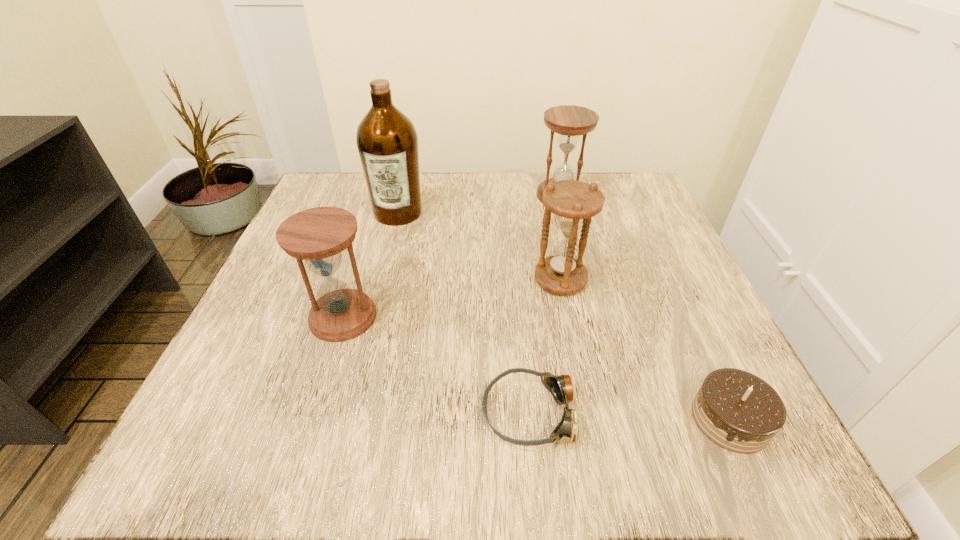
Identify which object is located as the fifth nearest to the chocolate cake. Please provide its 2D coordinates. Your answer should be formatted as a tuple, i.e. [(x, y)], where the tuple contains the x and y coordinates of a point satisfying the conditions above.

[(387, 141)]

At what (x,y) coordinates should I click in order to perform the action: click on object that is the fourth closest to the chocolate cake. Please return your answer as a coordinate pair (x, y). Looking at the image, I should click on (318, 236).

Point out which hourglass is positioned as the second nearest to the farthest hourglass. Please provide its 2D coordinates. Your answer should be formatted as a tuple, i.e. [(x, y)], where the tuple contains the x and y coordinates of a point satisfying the conditions above.

[(318, 236)]

You are a GUI agent. You are given a task and a screenshot of the screen. Output one action in this format:
    pyautogui.click(x=<x>, y=<y>)
    Task: Click on the hourglass that is the second closest to the chocolate cake
    This screenshot has width=960, height=540.
    Given the screenshot: What is the action you would take?
    pyautogui.click(x=569, y=121)

Locate an element on the screen. vacant region that satisfies the following two spatial constraints: 1. on the label of the rightmost object; 2. on the right side of the tallest object is located at coordinates (347, 419).

Locate an element on the screen. vacant area in the image that satisfies the following two spatial constraints: 1. through the lenses of the second shortest object; 2. on the right side of the shortest object is located at coordinates (532, 419).

Image resolution: width=960 pixels, height=540 pixels. I want to click on vacant space that satisfies the following two spatial constraints: 1. through the lenses of the goggles; 2. on the back side of the fifth tallest object, so click(532, 419).

Find the location of a particular element. vacant space that satisfies the following two spatial constraints: 1. on the label of the chocolate cake; 2. on the left side of the tallest object is located at coordinates (347, 419).